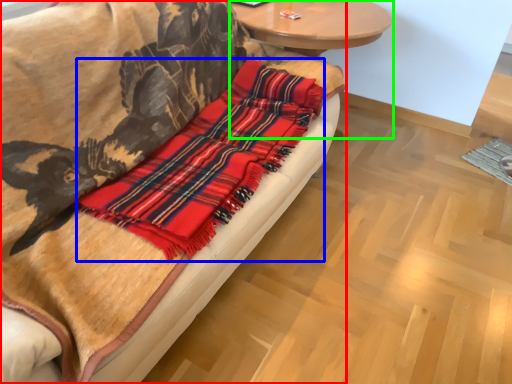
Question: Considering the real-world distances, which object is farthest from studio couch (highlighted by a red box)? flannel (highlighted by a blue box) or round table (highlighted by a green box)?

Choices:
 (A) flannel
 (B) round table

Answer: (B)